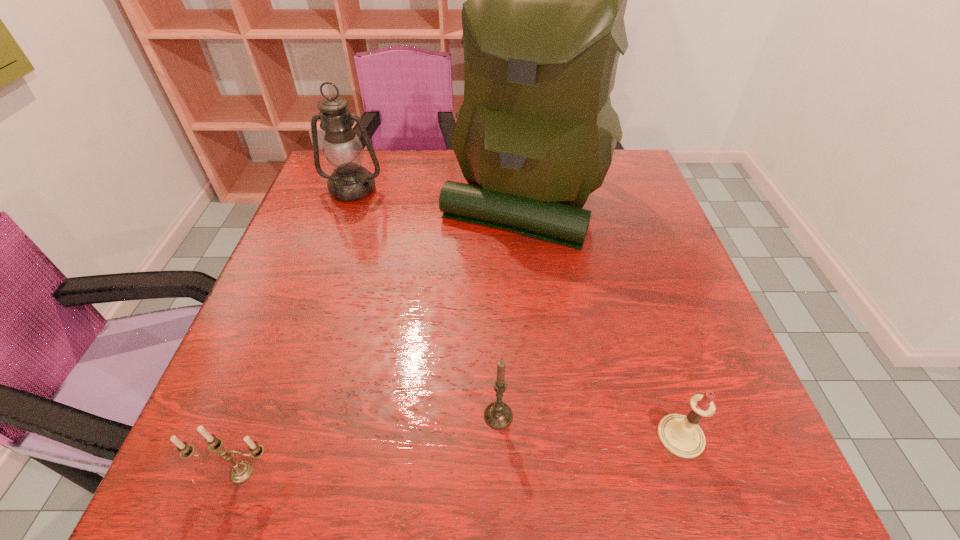
Where is `the closest candle to the second candle from right to left`? The image size is (960, 540). the closest candle to the second candle from right to left is located at coordinates (681, 435).

Find the location of a particular element. The image size is (960, 540). vacant position in the image that satisfies the following two spatial constraints: 1. on the front of the backpack with visible pockets; 2. on the right side of the rightmost candle is located at coordinates (549, 436).

Where is `vacant space that satisfies the following two spatial constraints: 1. on the front of the backpack with visible pockets; 2. on the left side of the rightmost candle`? vacant space that satisfies the following two spatial constraints: 1. on the front of the backpack with visible pockets; 2. on the left side of the rightmost candle is located at coordinates (549, 436).

In order to click on vacant space that satisfies the following two spatial constraints: 1. on the back side of the oil lamp; 2. on the left side of the nearest object in this screenshot , I will do pyautogui.click(x=345, y=189).

Locate an element on the screen. Image resolution: width=960 pixels, height=540 pixels. free space that satisfies the following two spatial constraints: 1. on the back side of the oil lamp; 2. on the right side of the nearest object is located at coordinates (345, 189).

I want to click on blank space that satisfies the following two spatial constraints: 1. on the back side of the fourth shortest object; 2. on the right side of the nearest candle, so click(x=345, y=189).